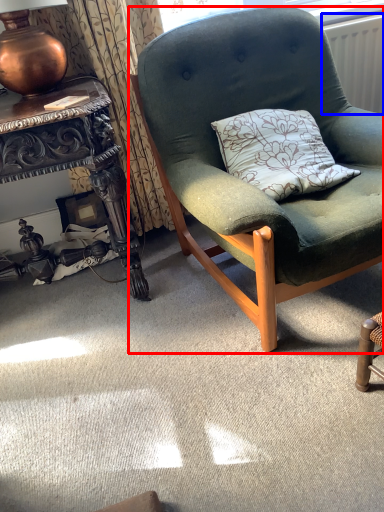
Question: Among these objects, which one is nearest to the camera, chair (highlighted by a red box) or radiator (highlighted by a blue box)?

Choices:
 (A) chair
 (B) radiator

Answer: (A)